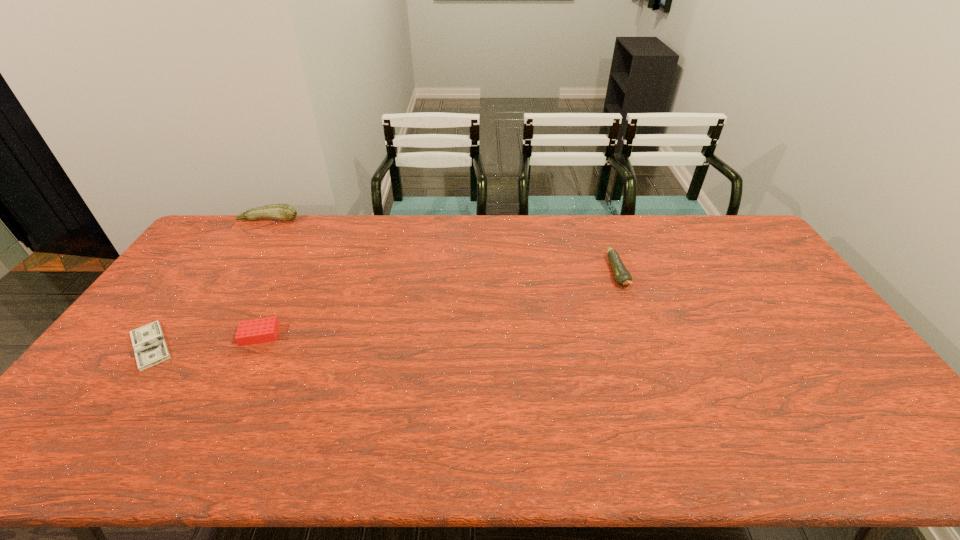
Where is `object that stands as the second closest to the rightmost object`? The height and width of the screenshot is (540, 960). object that stands as the second closest to the rightmost object is located at coordinates (285, 212).

You are a GUI agent. You are given a task and a screenshot of the screen. Output one action in this format:
    pyautogui.click(x=<x>, y=<y>)
    Task: Click on the object that is the third closest to the dollar
    The image size is (960, 540).
    Given the screenshot: What is the action you would take?
    pyautogui.click(x=622, y=276)

Where is `vacant area that satisfies the following two spatial constraints: 1. at the stem end of the farther zucchini; 2. on the left side of the third tallest object`? Image resolution: width=960 pixels, height=540 pixels. vacant area that satisfies the following two spatial constraints: 1. at the stem end of the farther zucchini; 2. on the left side of the third tallest object is located at coordinates (195, 335).